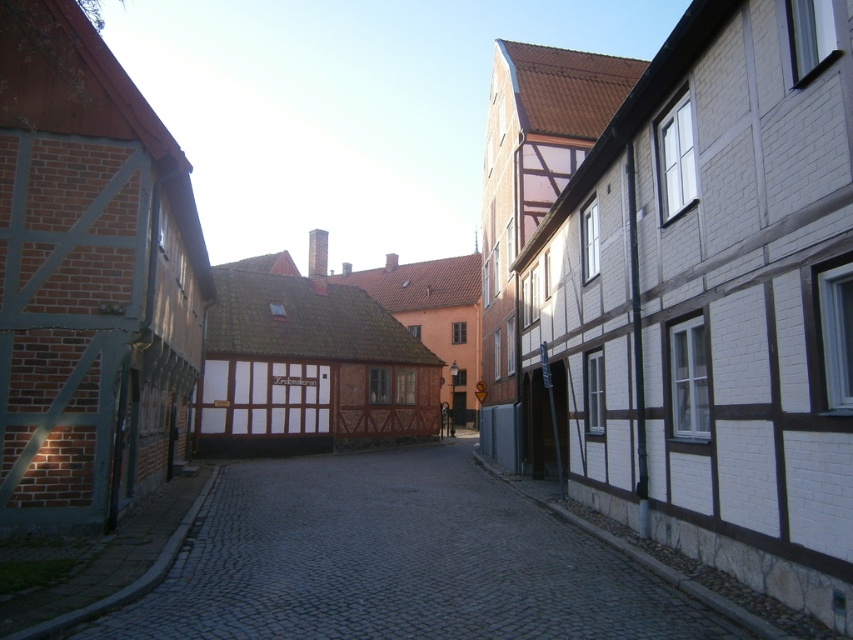
Is white wooden building at right taller than gray cobblestone alley at center?

Indeed, white wooden building at right has a greater height compared to gray cobblestone alley at center.

Does point (656, 468) come behind point (323, 540)?

That is False.

Find the location of a particular element. The width and height of the screenshot is (853, 640). white wooden building at right is located at coordinates (709, 305).